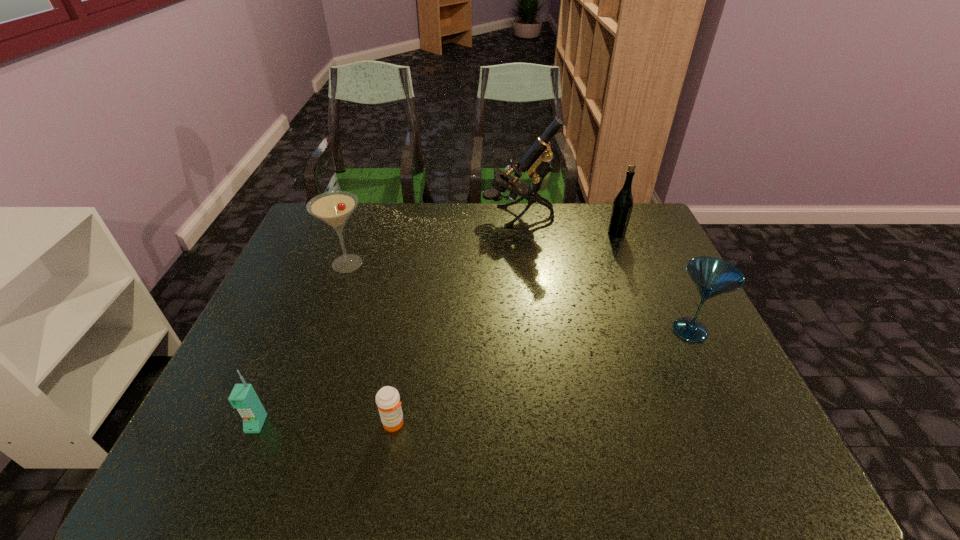
Where is `free space between the third object from right to left and the fourth farthest object`? This screenshot has height=540, width=960. free space between the third object from right to left and the fourth farthest object is located at coordinates (604, 273).

Locate an element on the screen. vacant space that is in between the fifth nearest object and the left martini is located at coordinates (482, 248).

At what (x,y) coordinates should I click in order to perform the action: click on unoccupied area between the tallest object and the medicine. Please return your answer as a coordinate pair (x, y). This screenshot has width=960, height=540. Looking at the image, I should click on (456, 320).

Locate an element on the screen. This screenshot has width=960, height=540. unoccupied area between the farther martini and the right martini is located at coordinates (518, 297).

Find the location of `free space that is in between the beer bottle and the third farthest object`. free space that is in between the beer bottle and the third farthest object is located at coordinates coord(482,248).

Identify the location of free area in between the third nearest object and the third farthest object. The width and height of the screenshot is (960, 540). (518, 297).

You are a GUI agent. You are given a task and a screenshot of the screen. Output one action in this format:
    pyautogui.click(x=<x>, y=<y>)
    Task: Click on the vacant point located between the farther martini and the medicine
    This screenshot has height=540, width=960.
    Given the screenshot: What is the action you would take?
    pyautogui.click(x=371, y=343)

At what (x,y) coordinates should I click in order to perform the action: click on free space that is in between the fifth nearest object and the tallest object. Please return your answer as a coordinate pair (x, y). Looking at the image, I should click on (567, 225).

The height and width of the screenshot is (540, 960). I want to click on free area in between the fourth object from right to left and the beer bottle, so click(x=505, y=328).

The width and height of the screenshot is (960, 540). Identify the location of vacant region between the beer bottle and the shortest object. tap(505, 328).